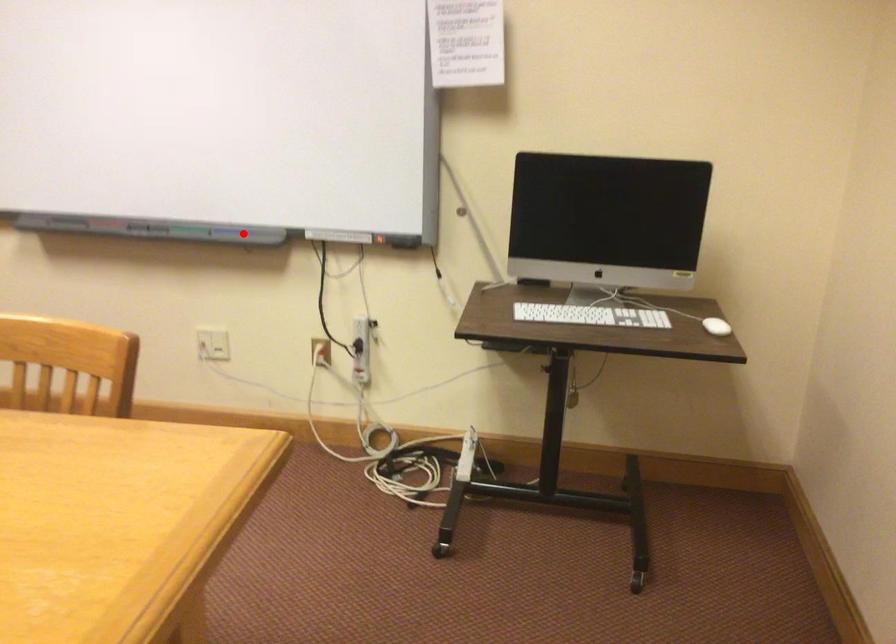
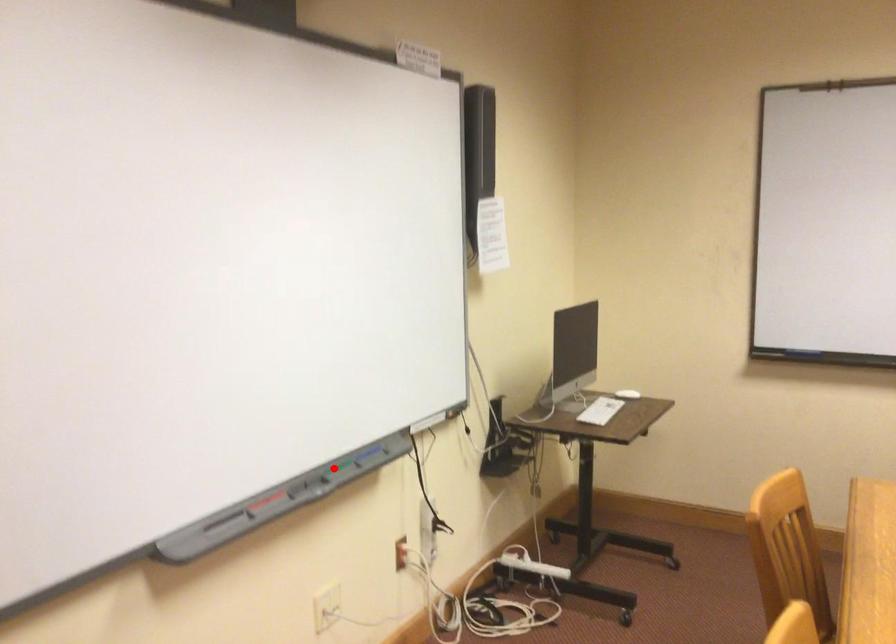
I am providing you with two images of the same scene from different viewpoints. A red point is marked on the first image and another point is marked on the second image. Do the highlighted points in image1 and image2 indicate the same real-world spot?

No